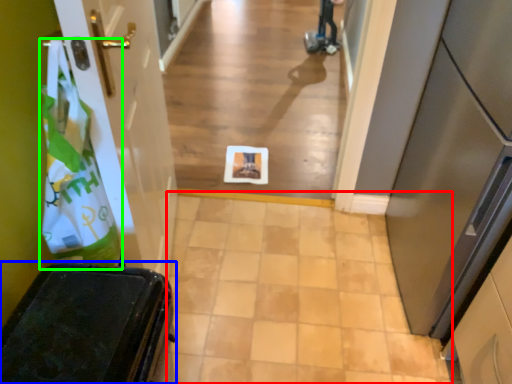
Question: Based on their relative distances, which object is farther from path (highlighted by a red box)? Choose from furniture (highlighted by a blue box) and shopping bag (highlighted by a green box).

Choices:
 (A) furniture
 (B) shopping bag

Answer: (B)